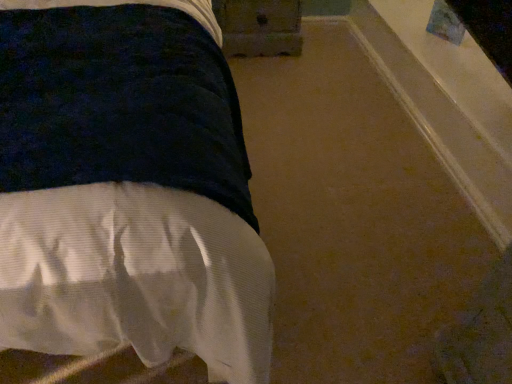
Question: From a real-world perspective, is wooden drawer at upper center above or below white textured bed at left?

Choices:
 (A) above
 (B) below

Answer: (A)

Question: Is point click(242, 41) positioned closer to the camera than point click(240, 367)?

Choices:
 (A) farther
 (B) closer

Answer: (A)

Question: From the image's perspective, is wooden drawer at upper center located above or below white textured bed at left?

Choices:
 (A) above
 (B) below

Answer: (A)

Question: In terms of size, does white textured bed at left appear bigger or smaller than wooden drawer at upper center?

Choices:
 (A) small
 (B) big

Answer: (B)

Question: From a real-world perspective, is white textured bed at left positioned above or below wooden drawer at upper center?

Choices:
 (A) below
 (B) above

Answer: (A)

Question: Considering the positions of point (161, 192) and point (243, 34), is point (161, 192) closer or farther from the camera than point (243, 34)?

Choices:
 (A) farther
 (B) closer

Answer: (B)

Question: Would you say white textured bed at left is to the left or to the right of wooden drawer at upper center in the picture?

Choices:
 (A) left
 (B) right

Answer: (A)